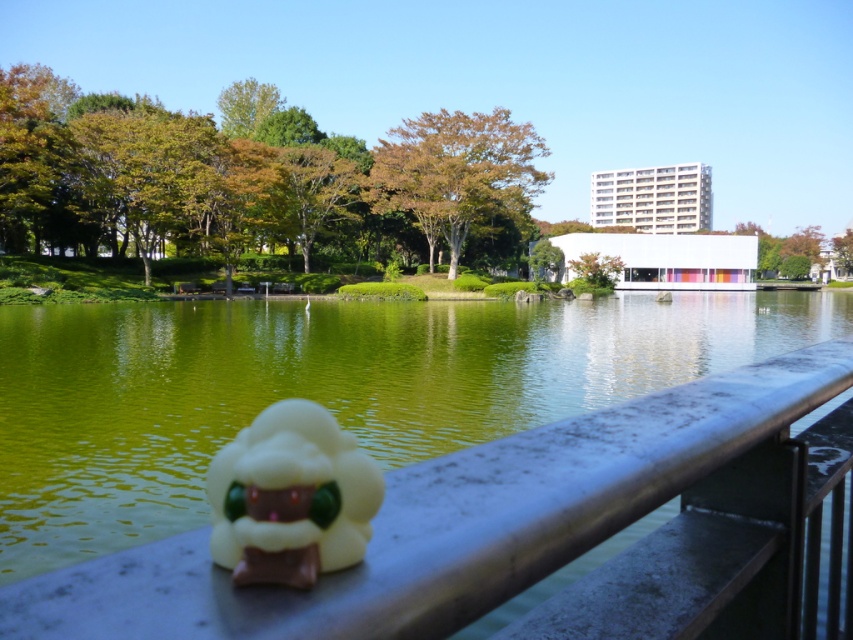
Question: Which point is closer to the camera?

Choices:
 (A) (492, 561)
 (B) (357, 468)

Answer: (B)

Question: In this image, where is metallic gray rail at lower center located relative to white matte plush toy at lower center?

Choices:
 (A) right
 (B) left

Answer: (A)

Question: Which point is closer to the camera taking this photo?

Choices:
 (A) (242, 538)
 (B) (183, 548)

Answer: (A)

Question: Which point is closer to the camera?

Choices:
 (A) (206, 483)
 (B) (335, 593)

Answer: (B)

Question: Does metallic gray rail at lower center appear on the left side of white matte plush toy at lower center?

Choices:
 (A) yes
 (B) no

Answer: (B)

Question: In this image, where is metallic gray rail at lower center located relative to white matte plush toy at lower center?

Choices:
 (A) below
 (B) above

Answer: (A)